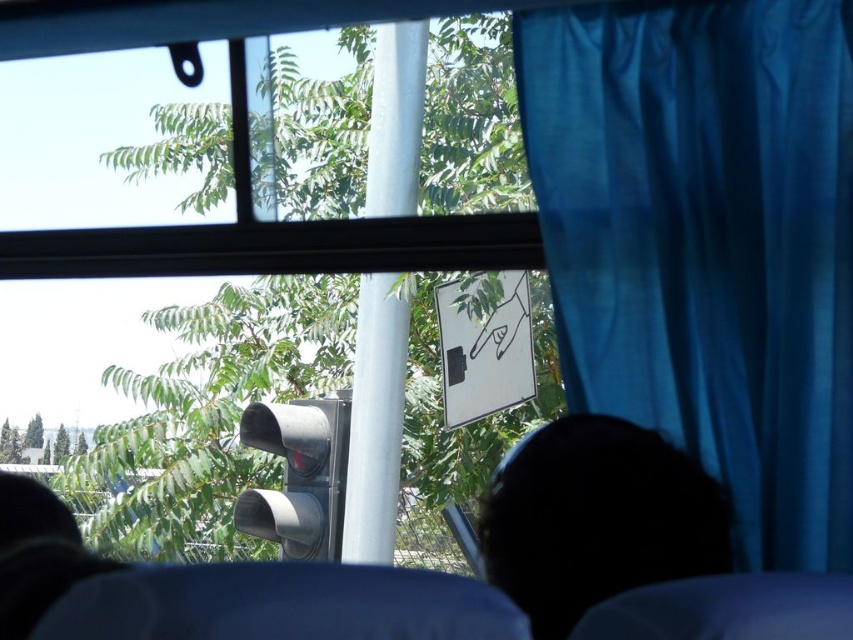
Question: Which point is farther to the camera?

Choices:
 (A) (645, 141)
 (B) (483, 550)

Answer: (A)

Question: Which object appears closest to the camera in this image?

Choices:
 (A) black matte head at lower center
 (B) blue fabric curtain at right

Answer: (A)

Question: Can you confirm if blue fabric curtain at right is bigger than metallic gray traffic light at center?

Choices:
 (A) no
 (B) yes

Answer: (B)

Question: Which point is farther to the camera?

Choices:
 (A) black matte head at lower center
 (B) blue fabric curtain at right

Answer: (B)

Question: Can you confirm if blue fabric curtain at right is positioned to the right of metallic gray traffic light at center?

Choices:
 (A) yes
 (B) no

Answer: (A)

Question: Is black matte head at lower center bigger than metallic gray traffic light at center?

Choices:
 (A) no
 (B) yes

Answer: (A)